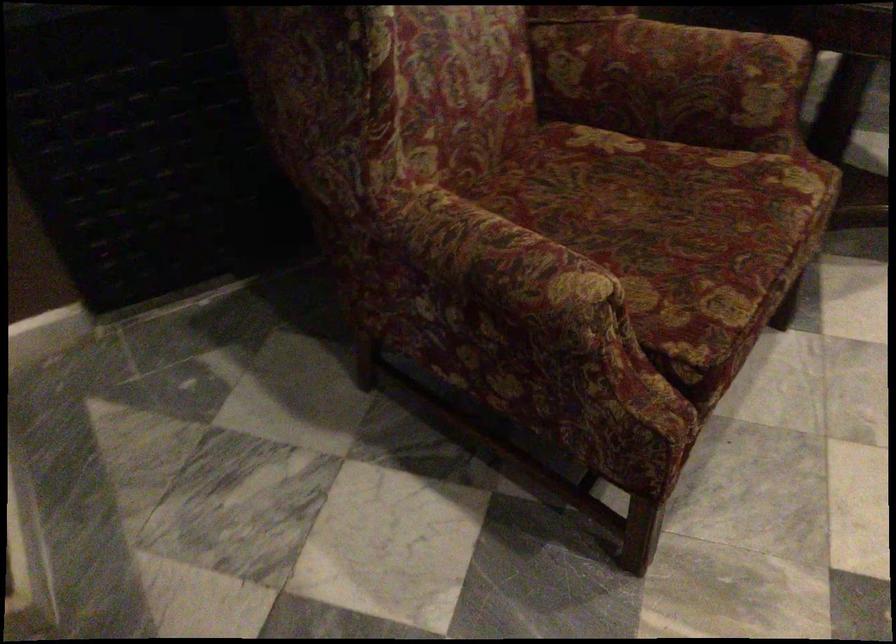
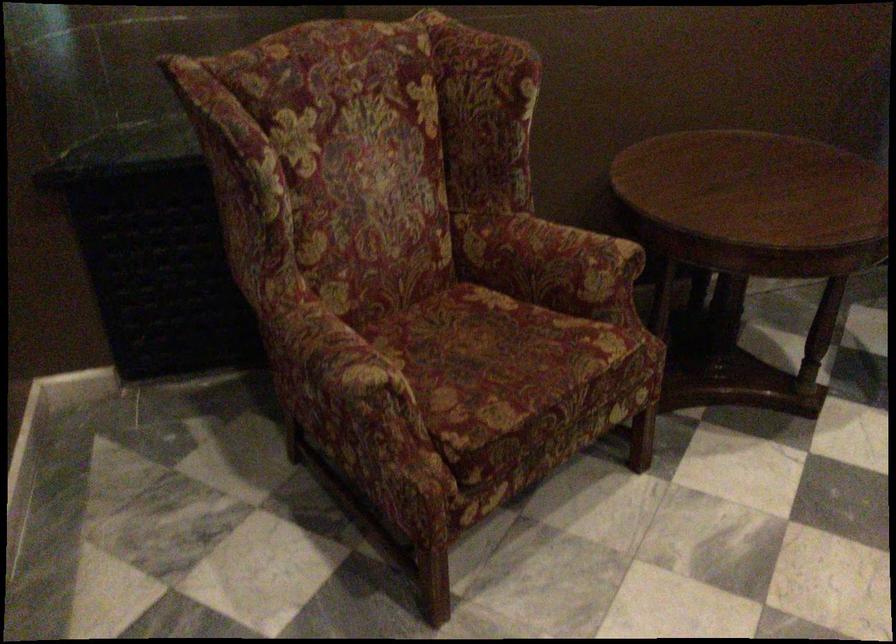
Find the pixel in the second image that matches point 719,71 in the first image.

(572, 256)